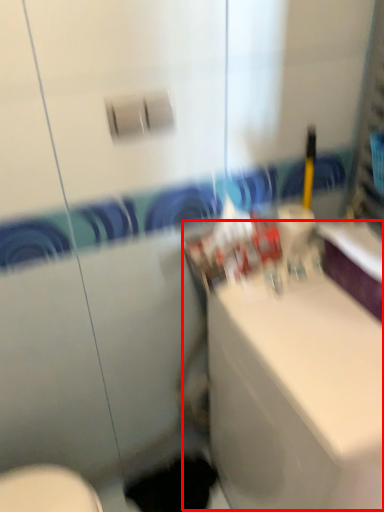
Question: From the image, what is the correct spatial relationship of counter top (annotated by the red box) in relation to hole?

Choices:
 (A) left
 (B) right

Answer: (B)